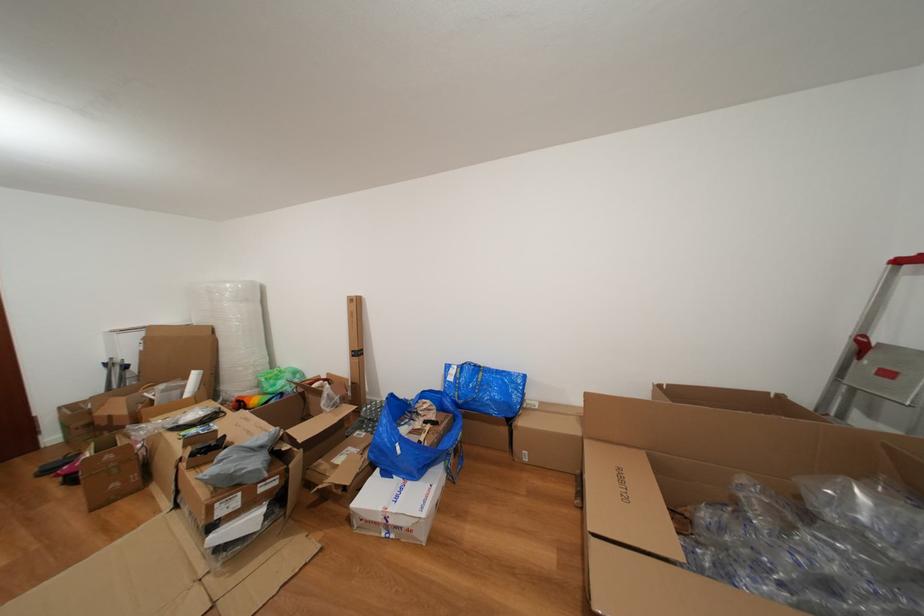
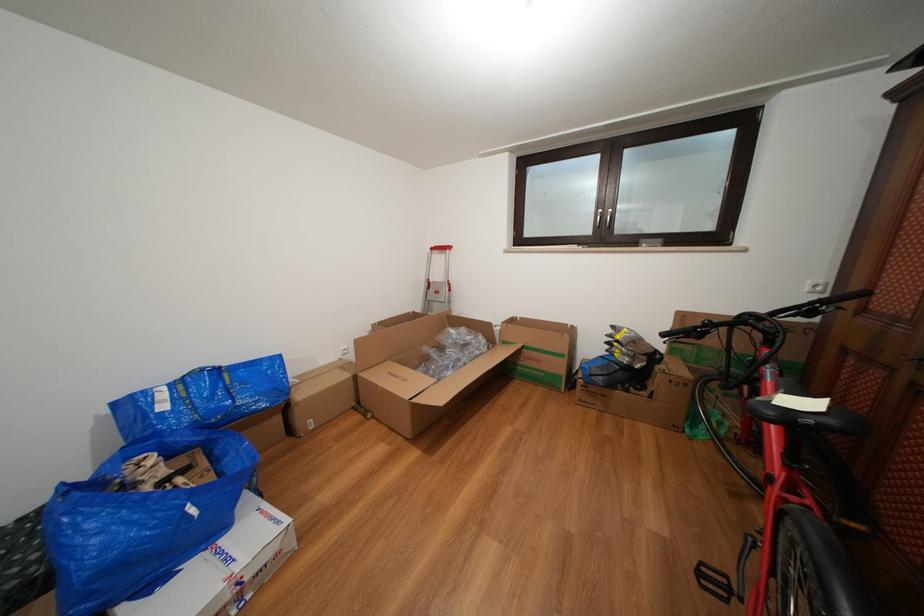
The point at (407, 454) is marked in the first image. Where is the corresponding point in the second image?

(201, 516)